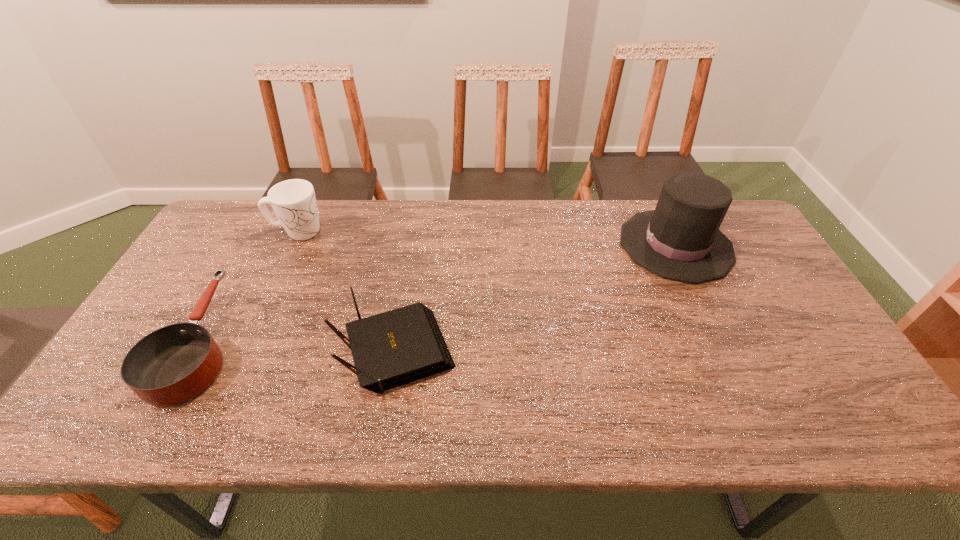
The width and height of the screenshot is (960, 540). In order to click on object that is at the near left corner in this screenshot , I will do `click(171, 365)`.

The image size is (960, 540). Find the location of `object at the far right corner`. object at the far right corner is located at coordinates (680, 240).

Find the location of a particular element. This screenshot has width=960, height=540. vacant area at the far edge of the desktop is located at coordinates (359, 205).

Identify the location of vacant space at the far left corner. Image resolution: width=960 pixels, height=540 pixels. (254, 240).

In the image, there is a desktop. Identify the location of vacant space at the near left corner. (114, 410).

Find the location of a particular element. vacant space at the near right corner is located at coordinates (816, 420).

You are a GUI agent. You are given a task and a screenshot of the screen. Output one action in this format:
    pyautogui.click(x=<x>, y=<y>)
    Task: Click on the vacant space that is in between the third object from left to right and the shortest object
    
    Given the screenshot: What is the action you would take?
    pyautogui.click(x=299, y=347)

Where is `unoccupied area between the pan and the second shortest object`? The image size is (960, 540). unoccupied area between the pan and the second shortest object is located at coordinates (299, 347).

Where is `free spot between the pan and the third tallest object`? free spot between the pan and the third tallest object is located at coordinates (299, 347).

You are a GUI agent. You are given a task and a screenshot of the screen. Output one action in this format:
    pyautogui.click(x=<x>, y=<y>)
    Task: Click on the vacant area between the second object from right to left and the rightmost object
    Image resolution: width=960 pixels, height=540 pixels.
    Given the screenshot: What is the action you would take?
    pyautogui.click(x=536, y=300)